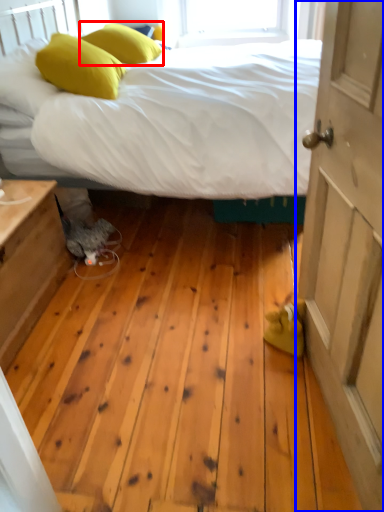
Question: Which object is closer to the camera taking this photo, pillow (highlighted by a red box) or door (highlighted by a blue box)?

Choices:
 (A) pillow
 (B) door

Answer: (B)